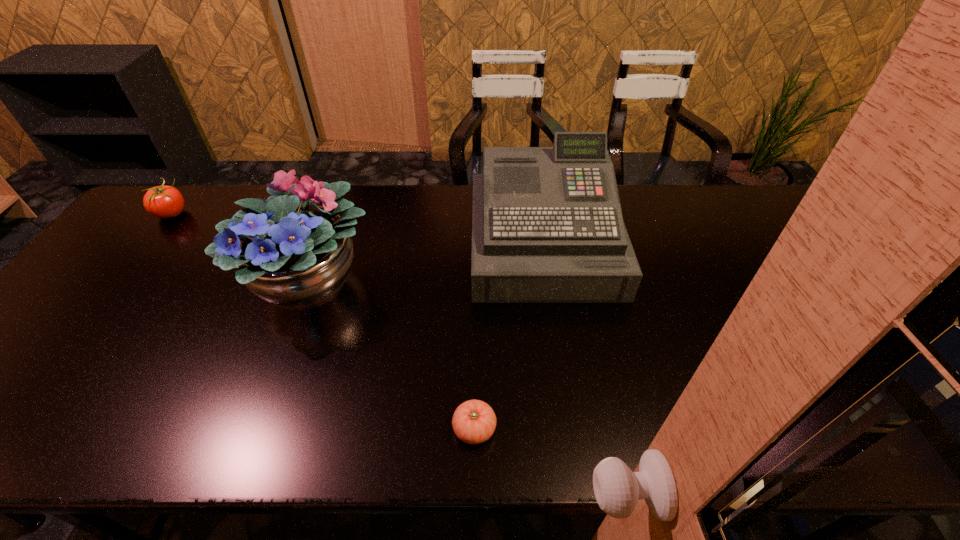
Find the location of a particular element. The width and height of the screenshot is (960, 540). vacant space that satisfies the following two spatial constraints: 1. on the front side of the second shortest object; 2. on the right side of the bouquet is located at coordinates (118, 282).

Identify the location of free region that satisfies the following two spatial constraints: 1. on the front side of the right tomato; 2. on the left side of the bouquet. Image resolution: width=960 pixels, height=540 pixels. (257, 429).

Find the location of `blank area in the image that satisfies the following two spatial constraints: 1. on the front side of the bouquet; 2. on the right side of the farther tomato`. blank area in the image that satisfies the following two spatial constraints: 1. on the front side of the bouquet; 2. on the right side of the farther tomato is located at coordinates (118, 282).